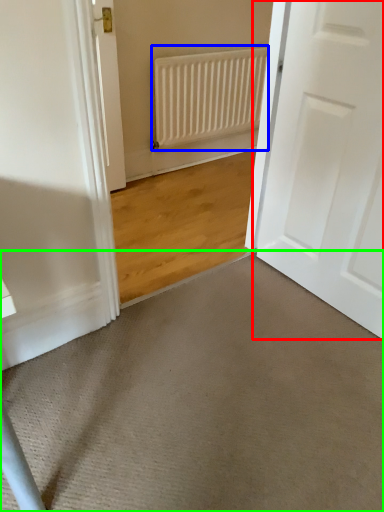
Question: Which is nearer to the door (highlighted by a red box)? radiator (highlighted by a blue box) or doormat (highlighted by a green box).

Choices:
 (A) radiator
 (B) doormat

Answer: (B)